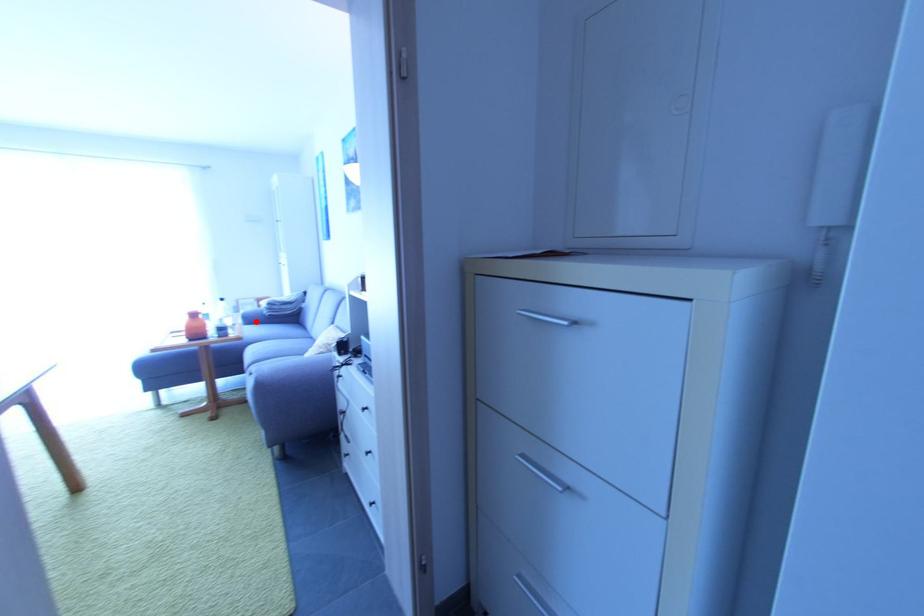
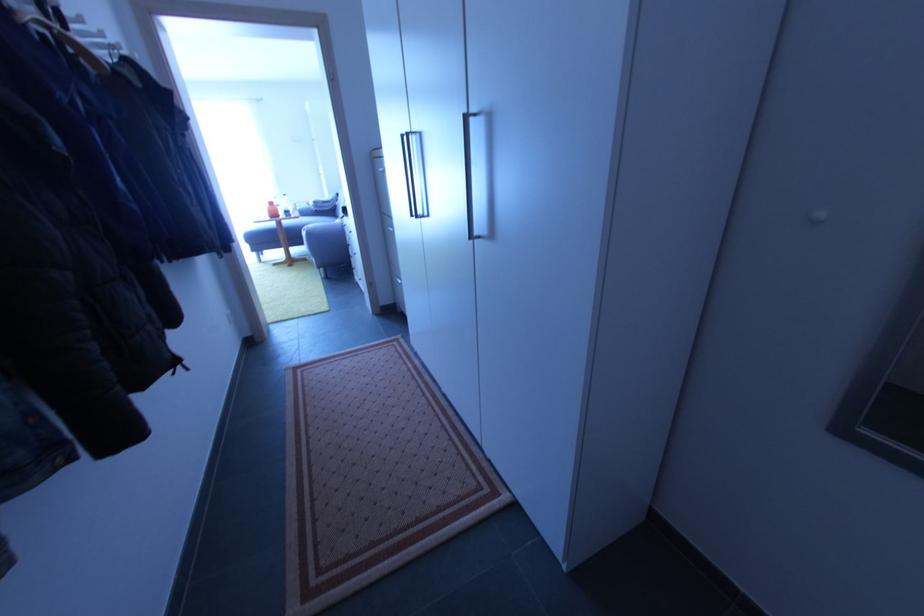
Locate, in the second image, the point that corresponds to the highlighted location in the first image.

(310, 216)